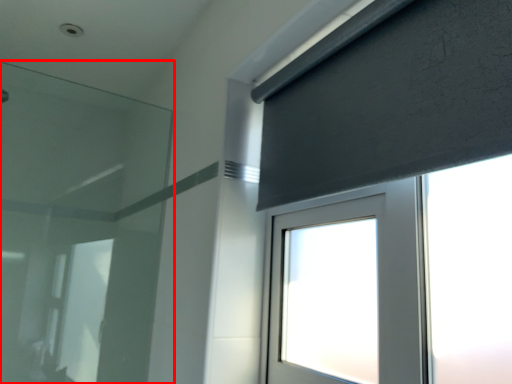
Question: From the image's perspective, where is filter (annotated by the red box) located in relation to curtain in the image?

Choices:
 (A) below
 (B) above

Answer: (A)